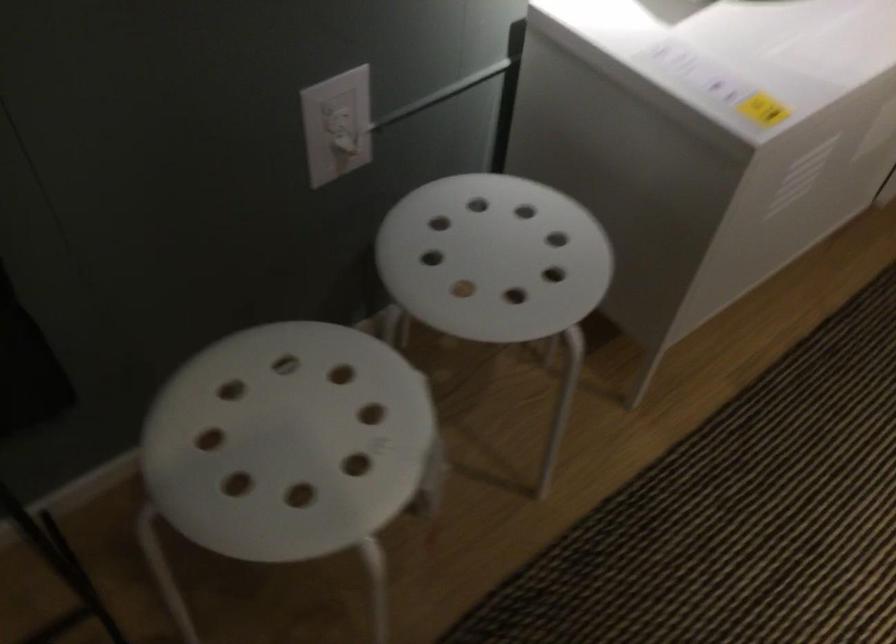
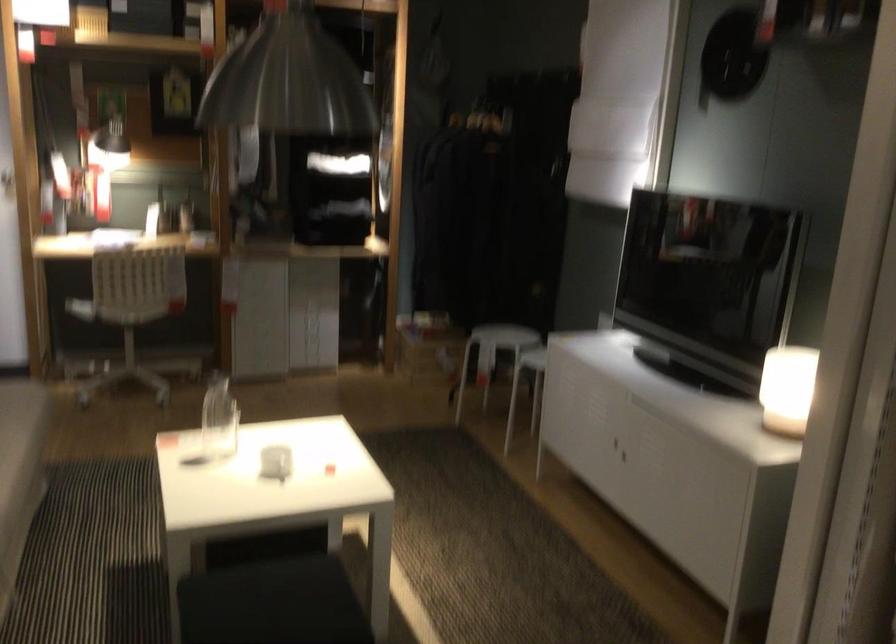
Question: I am providing you with two images of the same scene from different viewpoints. After the viewpoint changes to image2, which objects are now occluded?

Choices:
 (A) chair sitting surface
 (B) glowing table lamp
 (C) black stool
 (D) metal sink stopper

Answer: (A)